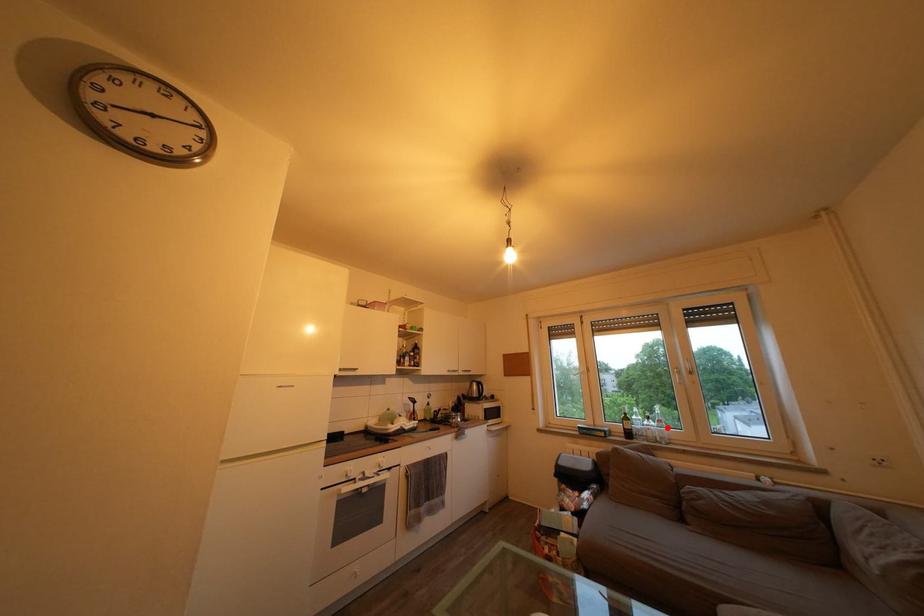
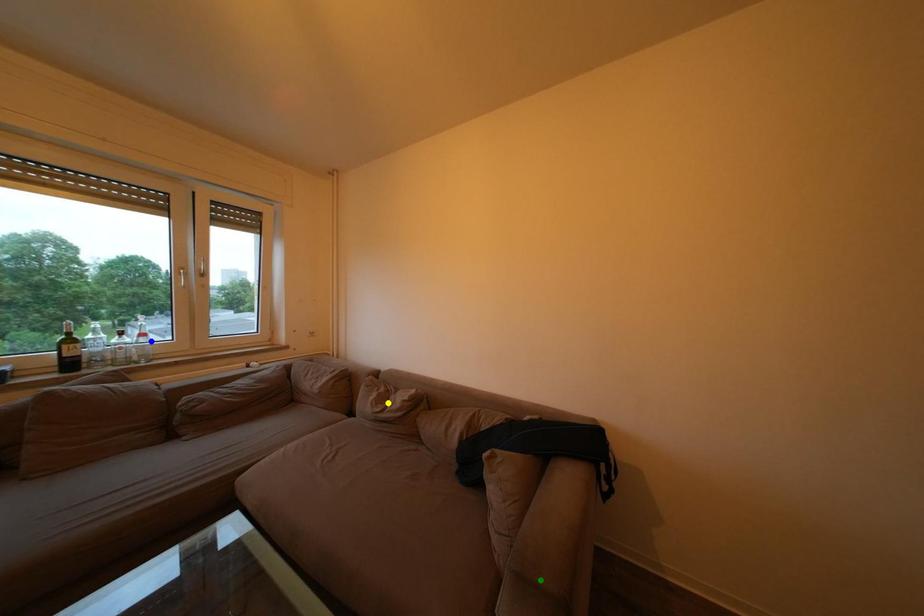
Question: I am providing you with two images of the same scene from different viewpoints. A red point is marked on the first image. You are given multiple points on the second image. Which mark in image 2 goes with the point in image 1?

Choices:
 (A) green point
 (B) yellow point
 (C) blue point

Answer: (C)